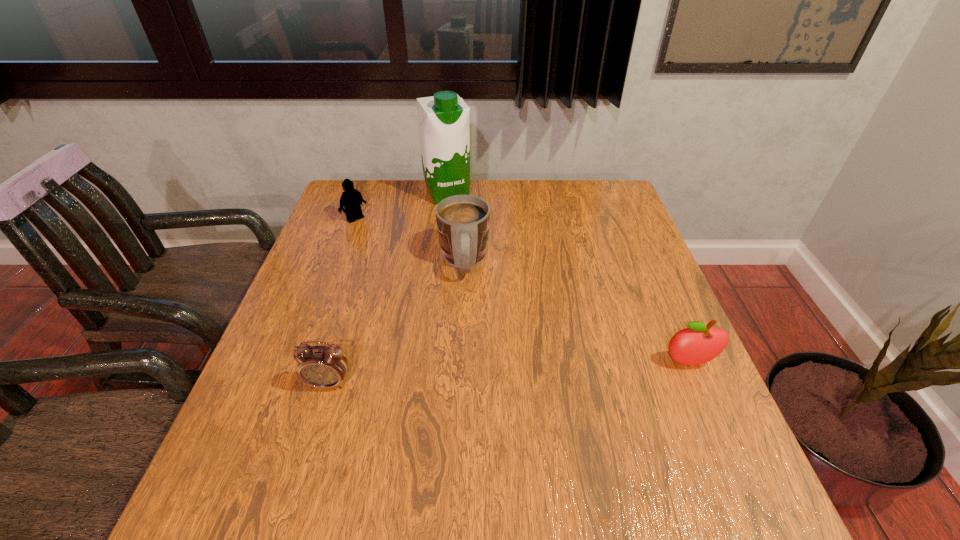
This screenshot has height=540, width=960. I want to click on vacant space located on the side of the mug with the handle, so click(x=469, y=349).

Identify the location of free space located on the side of the mug with the handle. This screenshot has width=960, height=540. (475, 420).

What are the coordinates of `free space located 0.340m on the face of the fourth nearest object` in the screenshot? It's located at (428, 282).

I want to click on free space located on the face of the fourth nearest object, so click(373, 234).

Image resolution: width=960 pixels, height=540 pixels. In order to click on free location located on the face of the fourth nearest object in this screenshot , I will do `click(383, 242)`.

The width and height of the screenshot is (960, 540). Identify the location of free space located 0.260m on the front-facing side of the tallest object. (482, 255).

Find the location of `vacant space located on the front-facing side of the tallest object`. vacant space located on the front-facing side of the tallest object is located at coordinates pos(500,288).

Find the location of `free space located on the front-facing side of the tallest object`. free space located on the front-facing side of the tallest object is located at coordinates (496, 280).

At what (x,y) coordinates should I click in order to perform the action: click on Lego that is at the far edge. Please return your answer as a coordinate pair (x, y). Looking at the image, I should click on (351, 199).

This screenshot has height=540, width=960. Find the location of `soya milk located in the far edge section of the desktop`. soya milk located in the far edge section of the desktop is located at coordinates (444, 119).